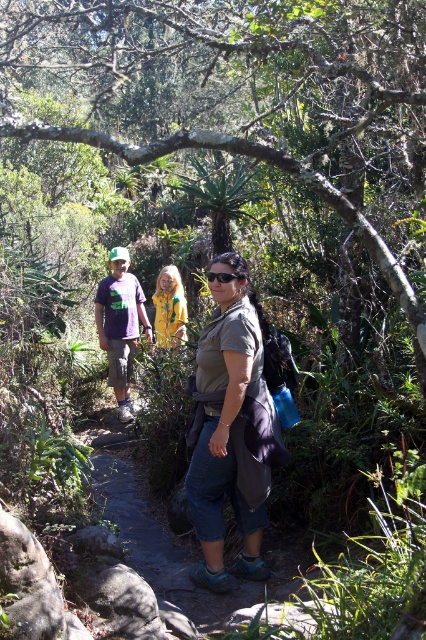
Based on the scene description, where is the matte khaki shirt at center positioned in relation to the other elements?

The matte khaki shirt at center is located at point coordinates of 0.672 on the x and 0.540 on the y axis. However, without additional spatial references to other objects, it is difficult to determine its exact position relative to other elements in the scene.

You are a photographer trying to capture the perfect shot of the two points in the scene. Which point is closer to your camera lens, point(158,312) or point(230,273)?

Point(158,312) is closer to the camera lens than point(230,273).

You are a photographer standing in the forest and want to take a photo of the yellow fabric jacket at center. Where should you position yourself to capture the jacket in the center of the photo?

To capture the yellow fabric jacket at center in the center of the photo, position yourself directly in front of it, aligning the jacket with the center point of your camera viewfinder or screen.